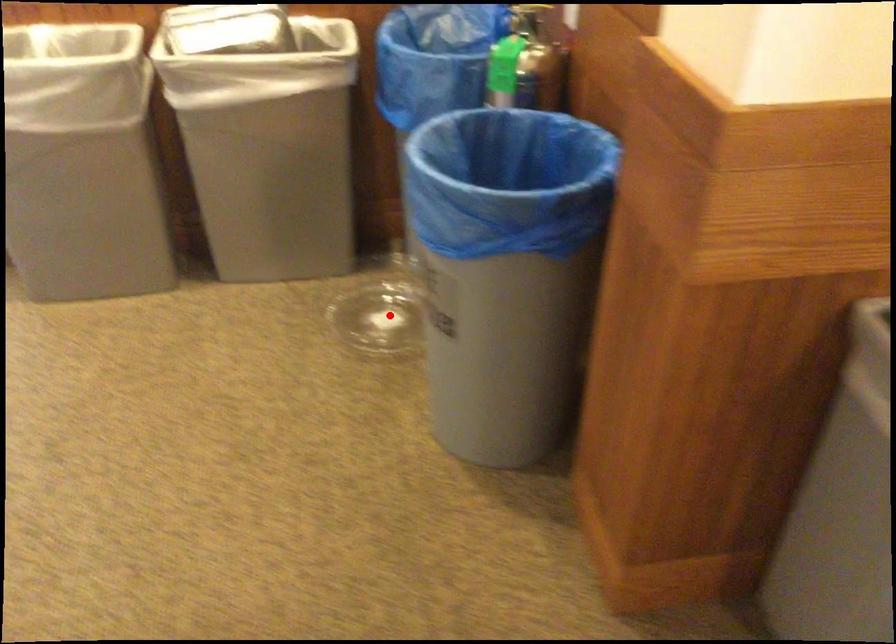
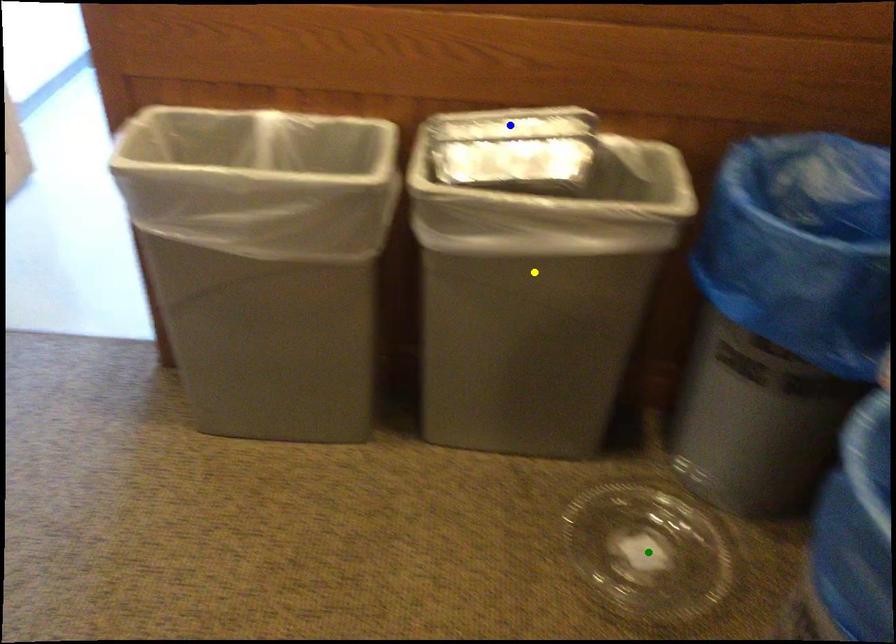
Question: I am providing you with two images of the same scene from different viewpoints. A red point is marked on the first image. You are given multiple points on the second image. Which point in image 2 represents the same 3d spot as the red point in image 1?

Choices:
 (A) yellow point
 (B) blue point
 (C) green point

Answer: (C)